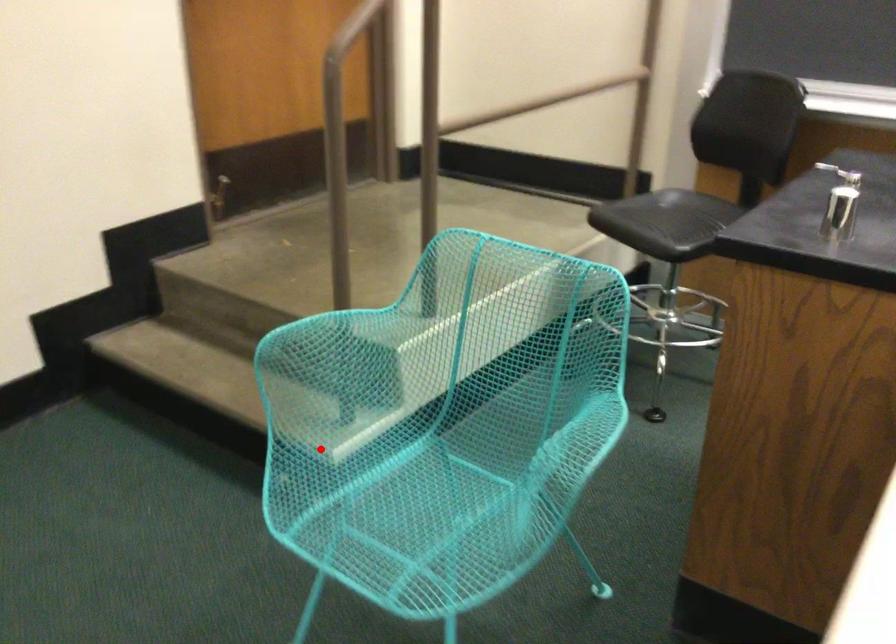
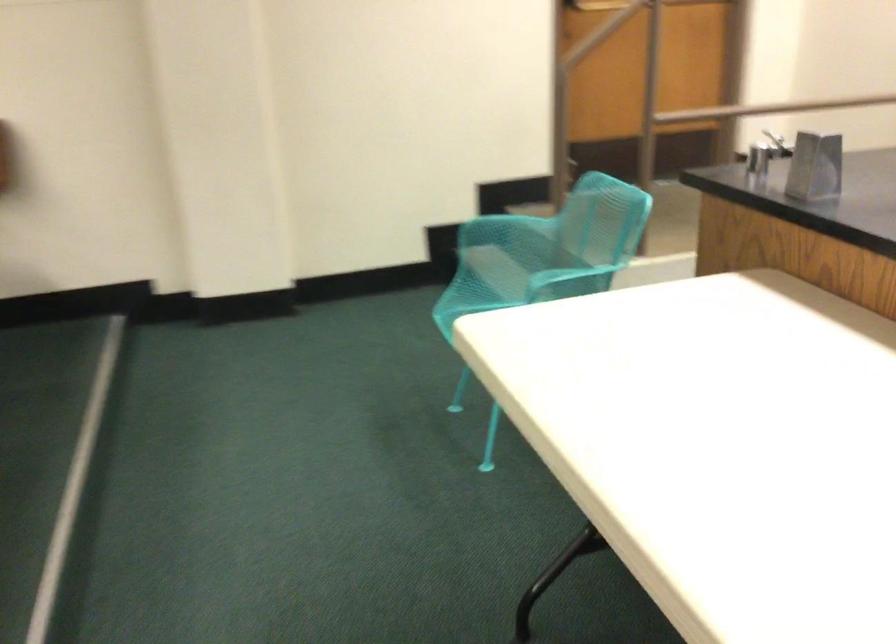
Locate, in the second image, the point that corresponds to the highlighted location in the first image.

(487, 289)